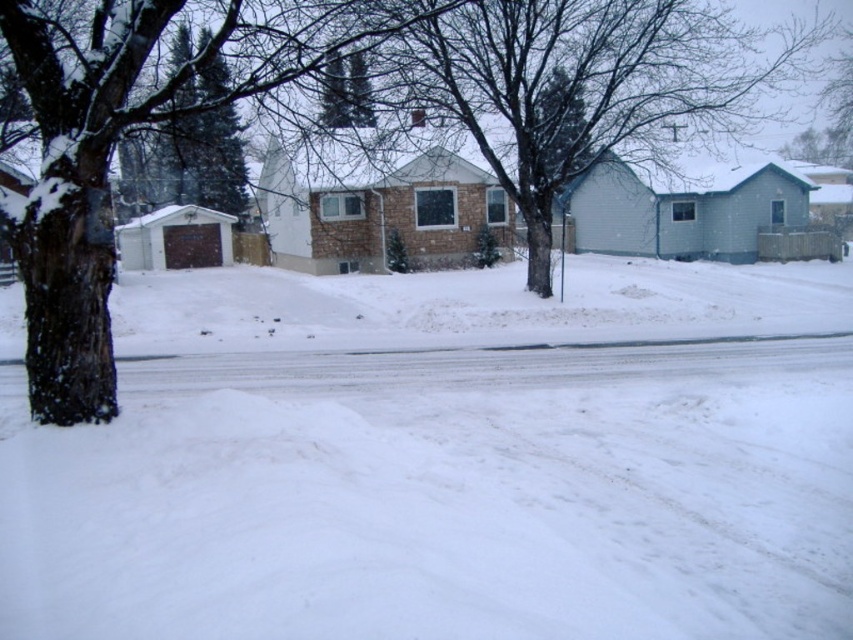
Question: Which object is closer to the camera taking this photo?

Choices:
 (A) bare branches at center
 (B) white fluffy snow at lower center

Answer: (B)

Question: Does white fluffy snow at lower center appear over bare branches at center?

Choices:
 (A) yes
 (B) no

Answer: (B)

Question: Is white fluffy snow at lower center closer to the viewer compared to bare branches at center?

Choices:
 (A) no
 (B) yes

Answer: (B)

Question: Which point is closer to the camera?

Choices:
 (A) bare branches at center
 (B) white fluffy snow at lower center

Answer: (B)

Question: Is white fluffy snow at lower center bigger than bare branches at center?

Choices:
 (A) no
 (B) yes

Answer: (A)